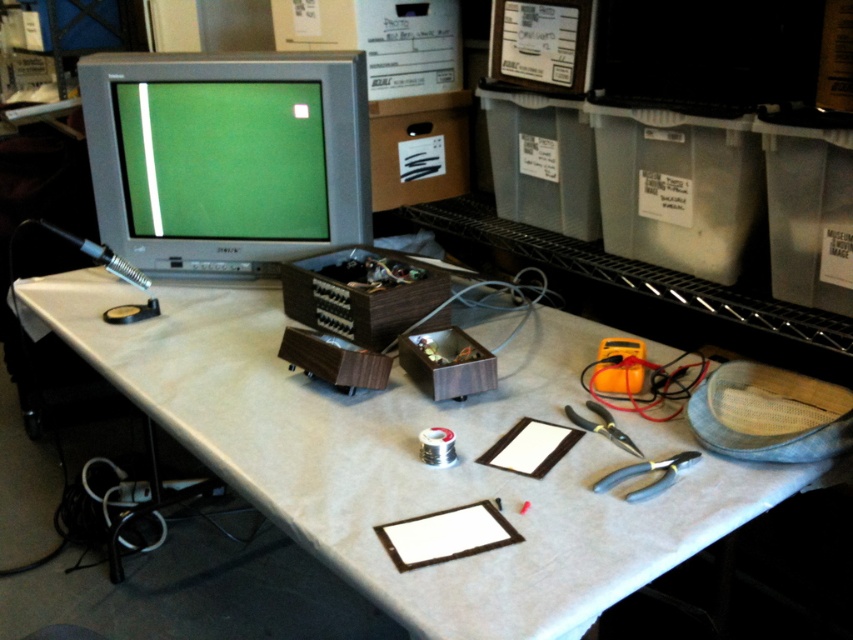
Question: Can you confirm if white matte computer desk at center is positioned to the left of black plastic pliers at lower right?

Choices:
 (A) no
 (B) yes

Answer: (B)

Question: Which of the following is the farthest from the observer?

Choices:
 (A) (606, 480)
 (B) (213, 426)
 (C) (328, 211)

Answer: (C)

Question: Observing the image, what is the correct spatial positioning of white matte computer desk at center in reference to black metal pliers at center?

Choices:
 (A) above
 (B) below

Answer: (A)

Question: Among these objects, which one is nearest to the camera?

Choices:
 (A) black plastic pliers at lower right
 (B) black metal pliers at center
 (C) matte gray monitor at upper left
 (D) white matte computer desk at center

Answer: (D)

Question: Estimate the real-world distances between objects in this image. Which object is closer to the matte gray monitor at upper left?

Choices:
 (A) white matte computer desk at center
 (B) black metal pliers at center
 (C) black plastic pliers at lower right

Answer: (A)

Question: Can you confirm if matte gray monitor at upper left is positioned above black metal pliers at center?

Choices:
 (A) yes
 (B) no

Answer: (A)